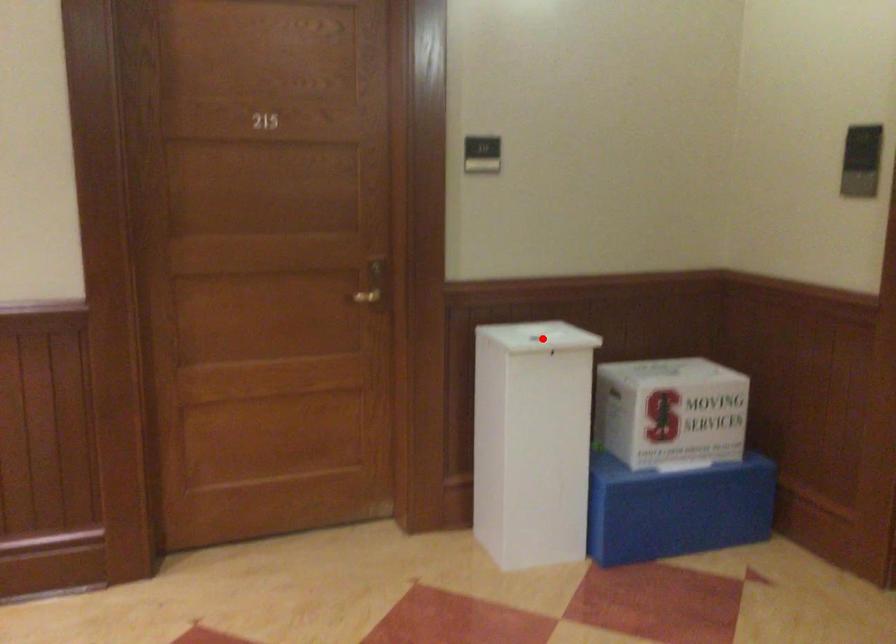
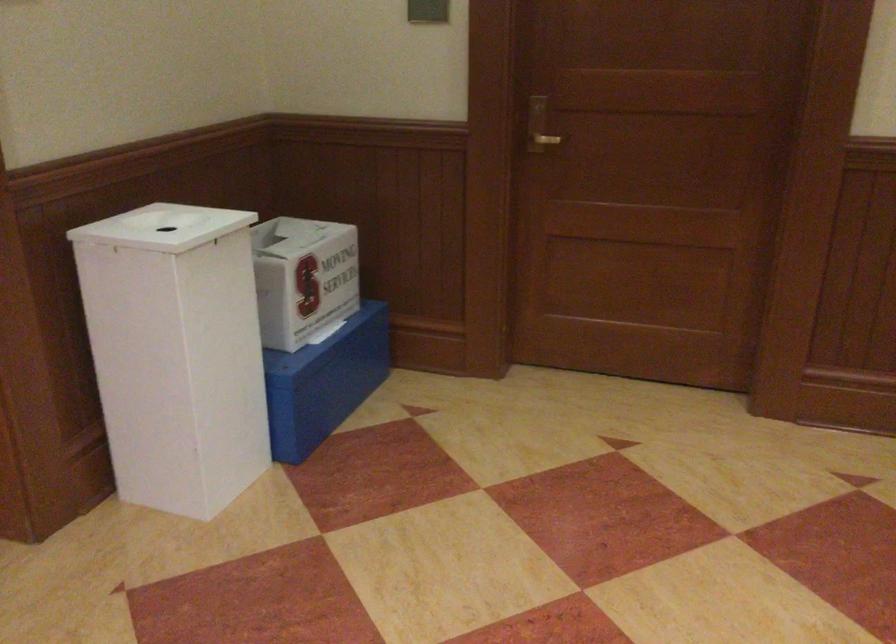
Question: I am providing you with two images of the same scene from different viewpoints. Image1 has a red point marked. In image2, the corresponding 3D location appears at what relative position? Reply with the corresponding letter.

Choices:
 (A) Closer
 (B) Farther

Answer: (A)